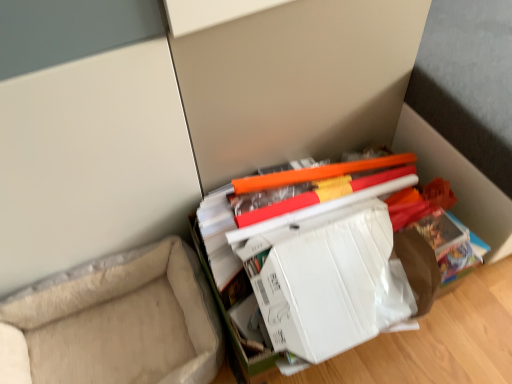
Question: Is white cardboard box at center a part of beige fabric couch at lower left?

Choices:
 (A) yes
 (B) no

Answer: (B)

Question: Can you confirm if beige fabric couch at lower left is positioned to the right of white cardboard box at center?

Choices:
 (A) yes
 (B) no

Answer: (B)

Question: Is beige fabric couch at lower left smaller than white cardboard box at center?

Choices:
 (A) no
 (B) yes

Answer: (A)

Question: Does beige fabric couch at lower left have a larger size compared to white cardboard box at center?

Choices:
 (A) no
 (B) yes

Answer: (B)

Question: From the image's perspective, does beige fabric couch at lower left appear higher than white cardboard box at center?

Choices:
 (A) yes
 (B) no

Answer: (B)

Question: Considering the relative positions of beige fabric couch at lower left and white cardboard box at center in the image provided, is beige fabric couch at lower left behind white cardboard box at center?

Choices:
 (A) no
 (B) yes

Answer: (B)

Question: Can you confirm if white cardboard box at center is positioned to the left of beige fabric couch at lower left?

Choices:
 (A) yes
 (B) no

Answer: (B)

Question: Does white cardboard box at center have a lesser height compared to beige fabric couch at lower left?

Choices:
 (A) yes
 (B) no

Answer: (B)

Question: Does white cardboard box at center have a larger size compared to beige fabric couch at lower left?

Choices:
 (A) yes
 (B) no

Answer: (B)

Question: Is white cardboard box at center placed right next to beige fabric couch at lower left?

Choices:
 (A) yes
 (B) no

Answer: (B)

Question: Is the depth of white cardboard box at center less than that of beige fabric couch at lower left?

Choices:
 (A) no
 (B) yes

Answer: (B)

Question: From the image's perspective, is white cardboard box at center over beige fabric couch at lower left?

Choices:
 (A) yes
 (B) no

Answer: (A)

Question: Visually, is beige fabric couch at lower left positioned to the left or to the right of white cardboard box at center?

Choices:
 (A) right
 (B) left

Answer: (B)